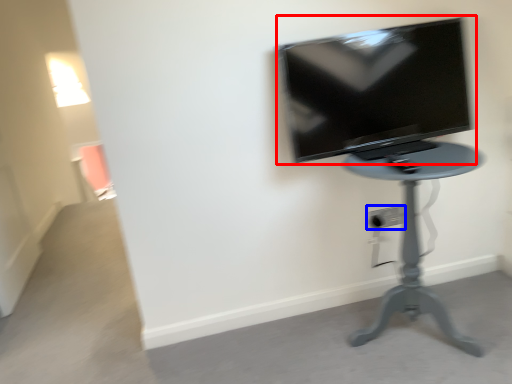
Question: Among these objects, which one is farthest to the camera, television (highlighted by a red box) or electric outlet (highlighted by a blue box)?

Choices:
 (A) television
 (B) electric outlet

Answer: (B)